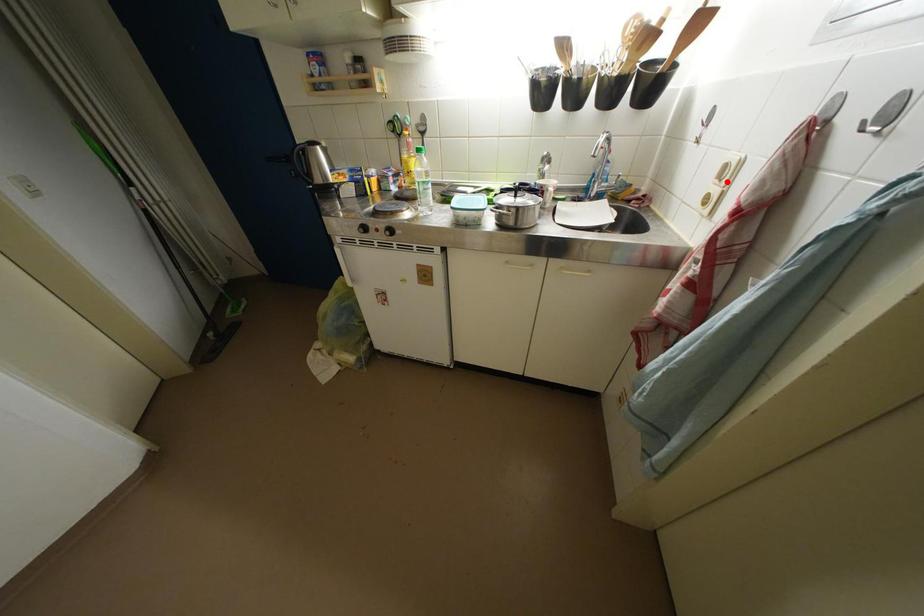
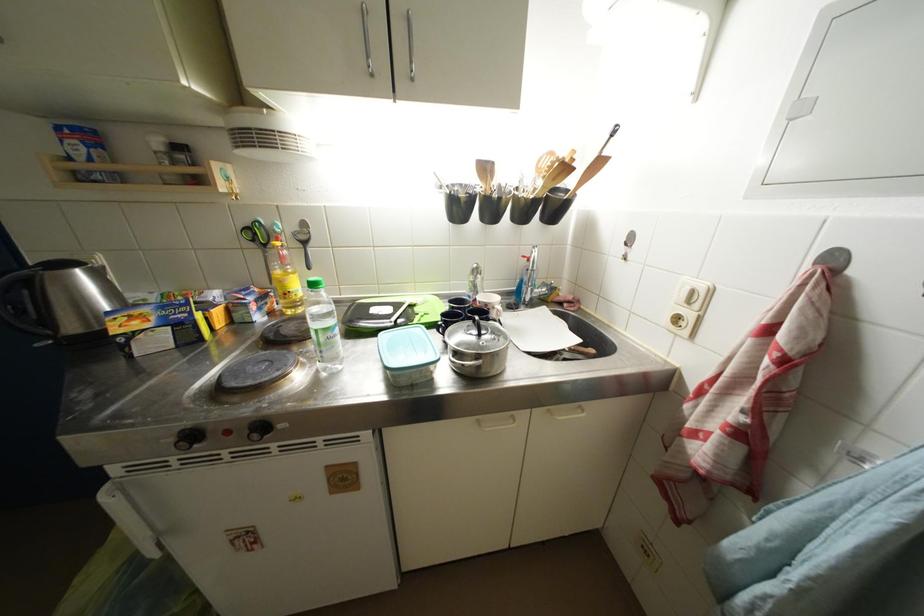
The point at the highlighted location is marked in the first image. Where is the corresponding point in the second image?

(696, 306)